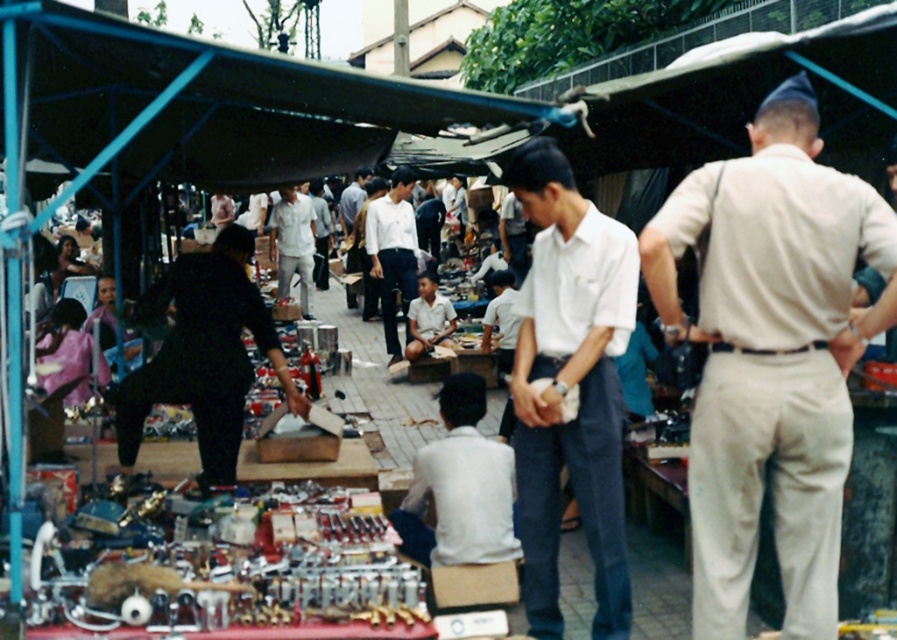
Which is more to the right, white cotton shirt at center or white smooth shirt at center?

Positioned to the right is white cotton shirt at center.

Based on the photo, between white cotton shirt at center and white smooth shirt at center, which one is positioned higher?

Positioned higher is white smooth shirt at center.

This screenshot has width=897, height=640. What are the coordinates of `white cotton shirt at center` in the screenshot? It's located at (570, 387).

Is beige cotton shirt at center bigger than white smooth shirt at center?

No, beige cotton shirt at center is not bigger than white smooth shirt at center.

Measure the distance between beige cotton shirt at center and camera.

beige cotton shirt at center and camera are 3.67 meters apart from each other.

Which is behind, point (803, 419) or point (373, 227)?

The point (373, 227) is more distant.

Where is `beige cotton shirt at center`? The image size is (897, 640). beige cotton shirt at center is located at coordinates (771, 356).

Which of these two, beige cotton shirt at center or white matte shirt at center, stands shorter?

With less height is white matte shirt at center.

Can you confirm if beige cotton shirt at center is wider than white matte shirt at center?

Indeed, beige cotton shirt at center has a greater width compared to white matte shirt at center.

This screenshot has width=897, height=640. Identify the location of beige cotton shirt at center. (771, 356).